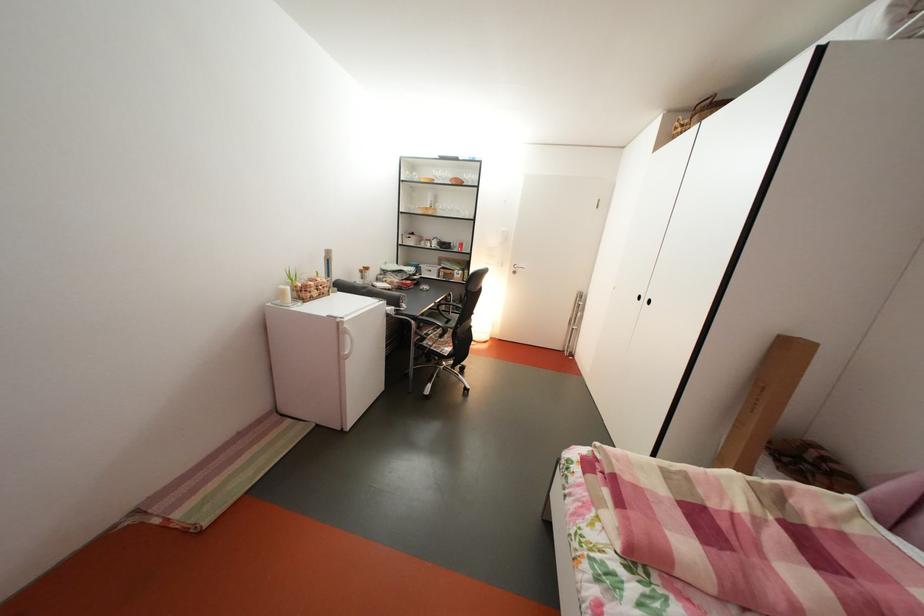
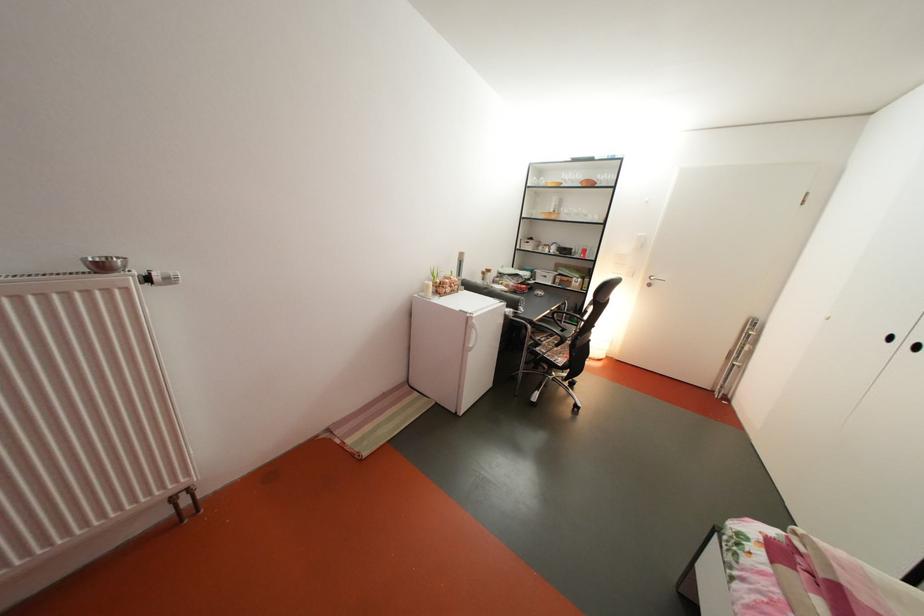
Consider the image. The images are taken continuously from a first-person perspective. In which direction are you moving?

The cameraman walked toward left, backward.